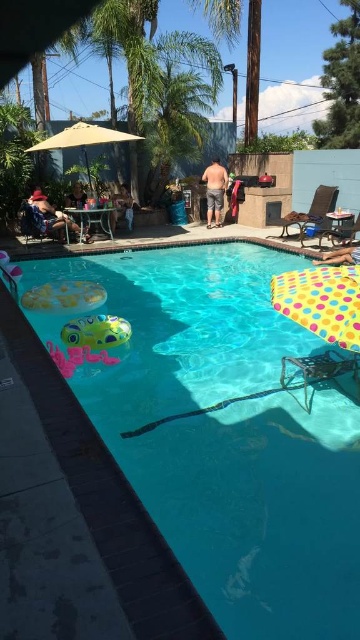
You are standing at the entrance of the backyard and want to locate the transparent plastic pool at center. According to the coordinates given, where should you look relative to the center of the image?

The transparent plastic pool at center is located at coordinates point [227,433], which is slightly to the right and below the center of the image.

You are standing at the edge of the swimming pool and looking towards the center. There are two points marked in the scene, point (272, 328) and point (345, 243). Which of these two points is closer to you?

Point (272, 328) is closer to the viewer than point (345, 243).